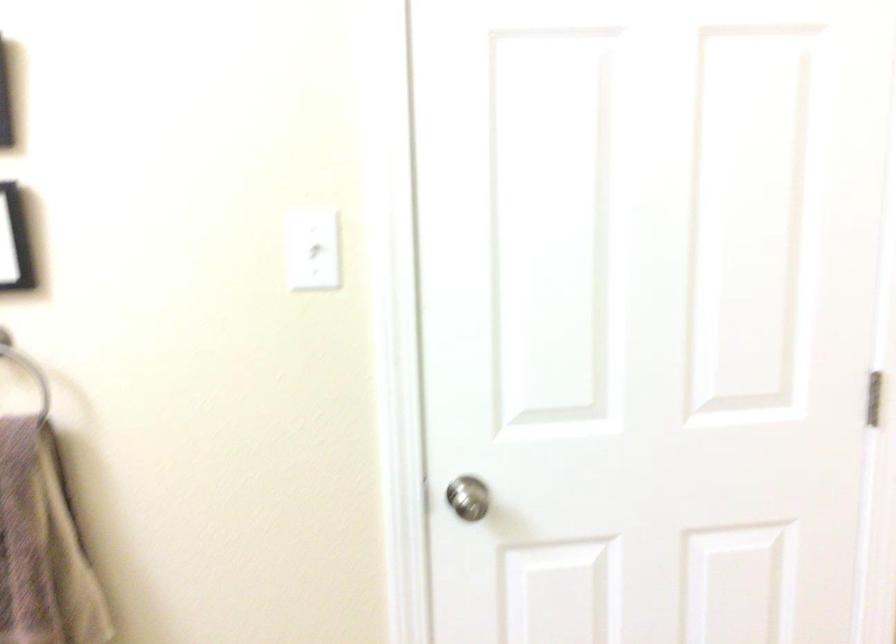
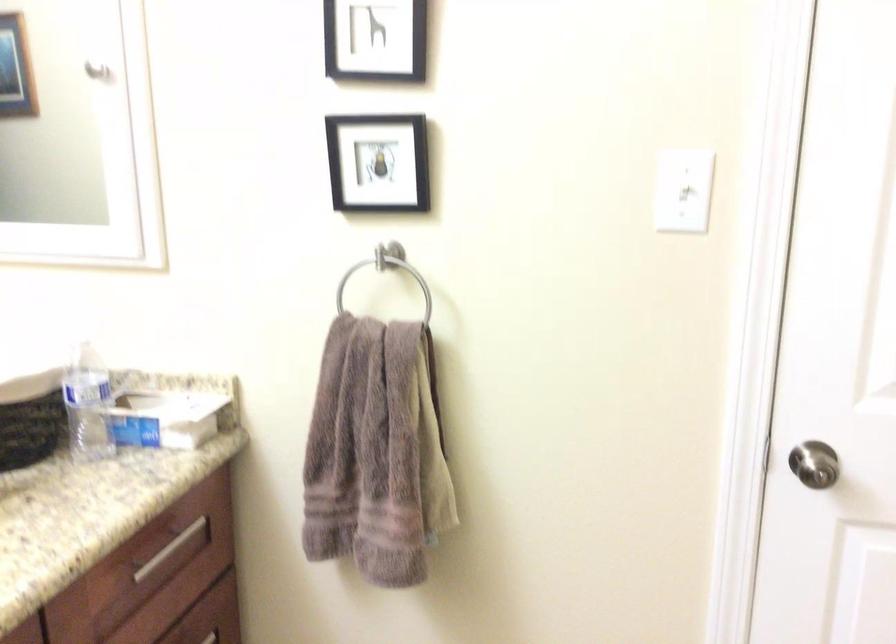
Locate, in the second image, the point that corresponds to the point at 313,247 in the first image.

(683, 190)